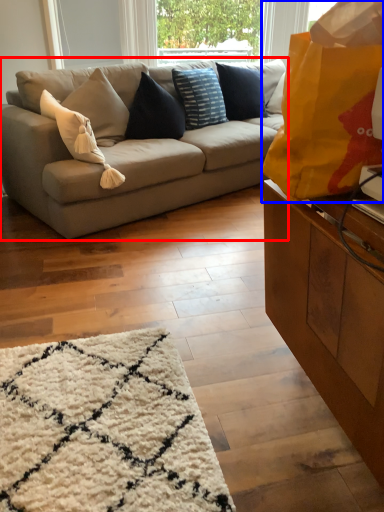
Question: Which of the following is the closest to the observer, studio couch (highlighted by a red box) or bag (highlighted by a blue box)?

Choices:
 (A) studio couch
 (B) bag

Answer: (B)